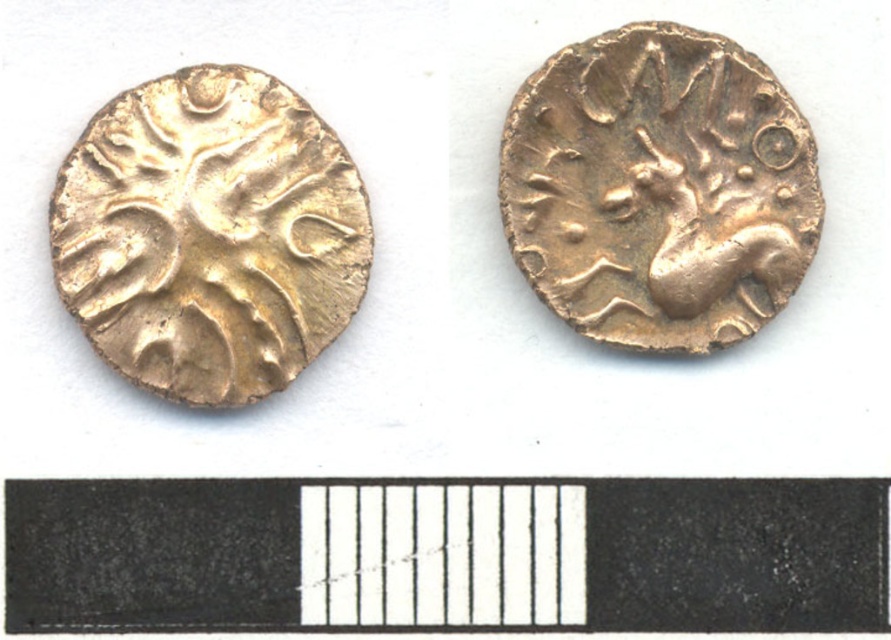
Question: Can you confirm if gold textured horse at upper right is wider than gold textured coin at left?

Choices:
 (A) yes
 (B) no

Answer: (A)

Question: Observing the image, what is the correct spatial positioning of gold textured horse at upper right in reference to gold textured coin at left?

Choices:
 (A) below
 (B) above

Answer: (B)

Question: Is gold textured horse at upper right positioned at the back of gold textured coin at left?

Choices:
 (A) yes
 (B) no

Answer: (A)

Question: Which of the following is the closest to the observer?

Choices:
 (A) gold textured horse at upper right
 (B) gold textured coin at left

Answer: (B)